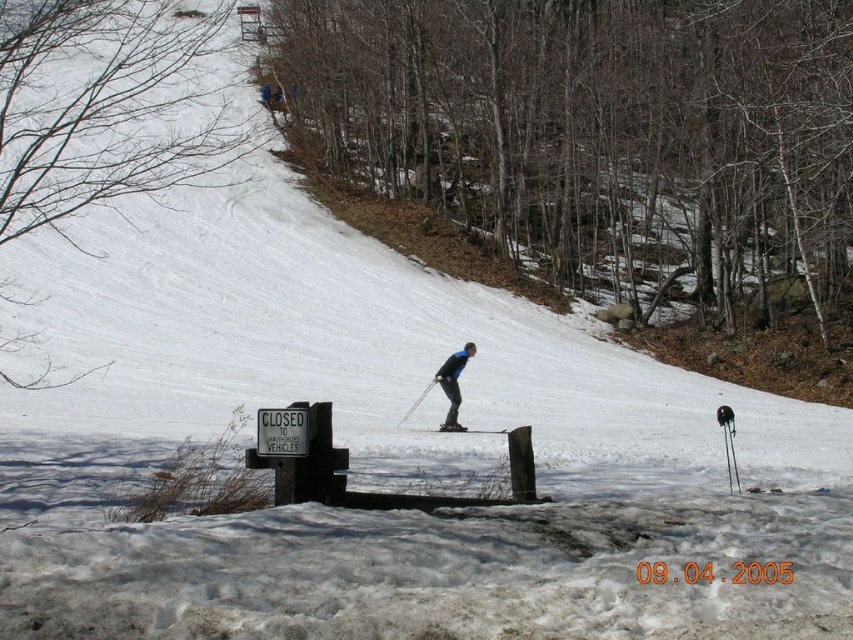
You are a photographer trying to capture a clear photo of both the blue fabric snowsuit at center and the blue matte skier at center. Given that your camera has a minimum focus distance of 2 inches, can you take a photo of both subjects without moving your position?

The blue fabric snowsuit at center and blue matte skier at center are 2.20 inches apart, which is greater than the camera minimum focus distance of 2 inches. Therefore, you can take a photo of both subjects without moving your position.

You are a photographer trying to capture the blue fabric snowsuit at center and the blue matte skier at center in the same frame. Based on their positions, which one should you adjust your camera to focus on first to ensure both are in the shot?

The blue fabric snowsuit at center is to the left of blue matte skier at center, so you should focus on the blue matte skier at center first since it is on the right side, ensuring the left object stays within the frame when adjusting.

Looking at this image, you are a photographer trying to capture the skier and their equipment. Based on the scene, where should you position your camera to ensure both the blue fabric snowsuit at center and the black matte ski at center are clearly visible in the frame?

Position your camera to the right of the blue fabric snowsuit at center so that the black matte ski at center is visible to the right of it, as the blue fabric snowsuit at center is to the left of the black matte ski at center.